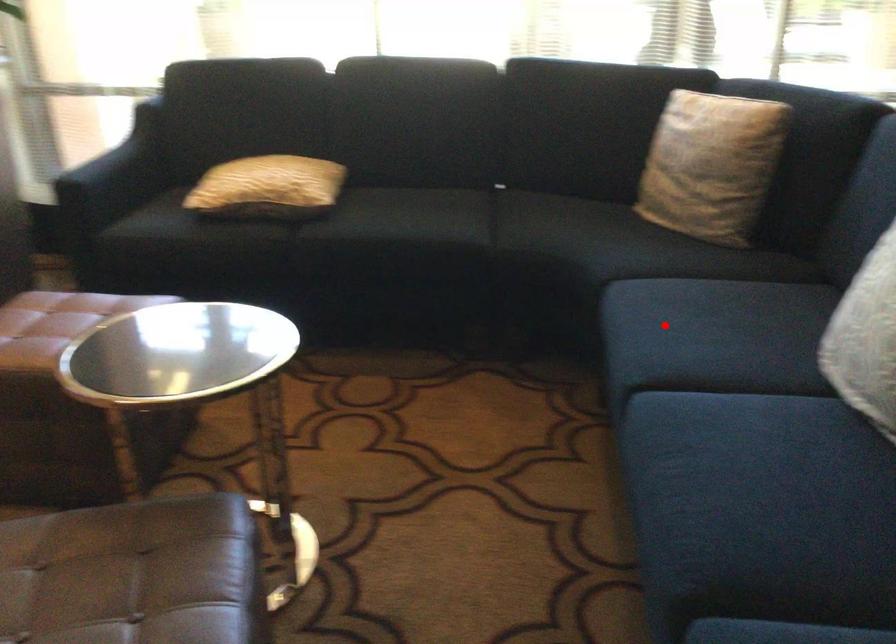
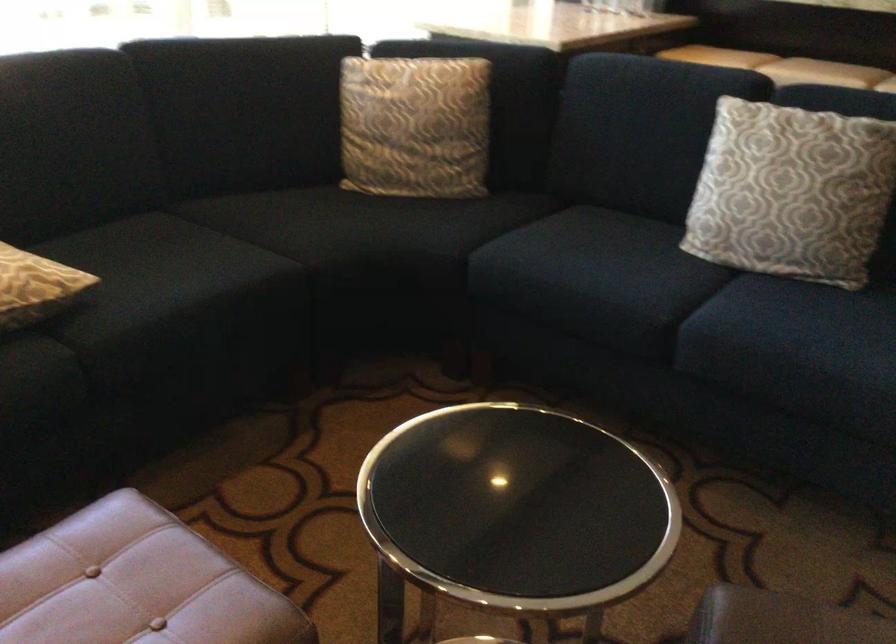
Locate, in the second image, the point that corresponds to the highlighted location in the first image.

(590, 274)